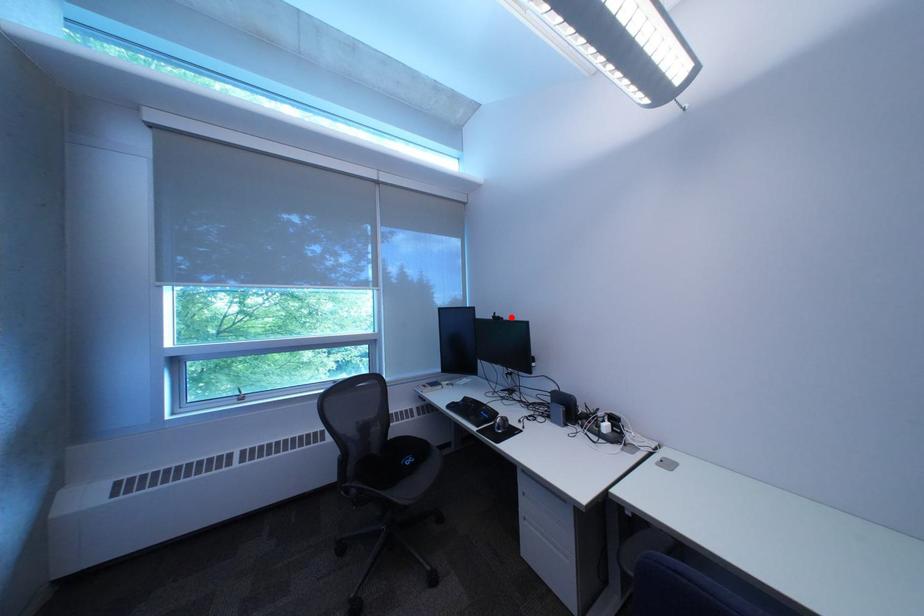
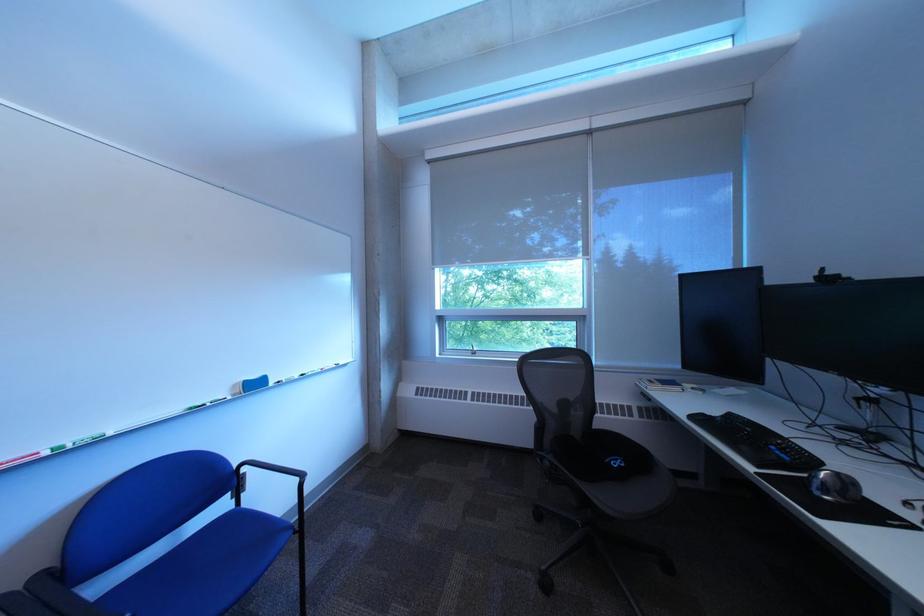
Find the pixel in the second image that matches the highlighted location in the first image.

(843, 275)